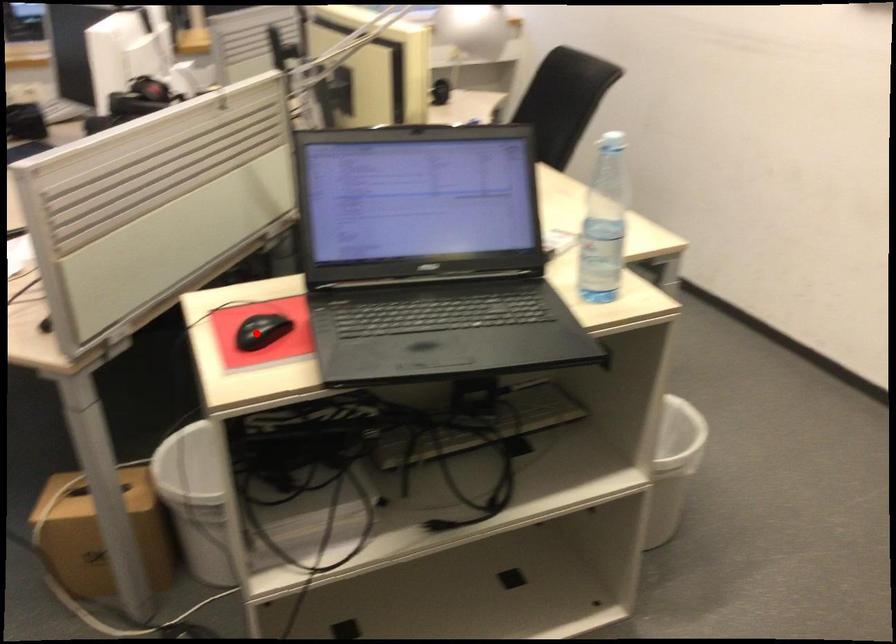
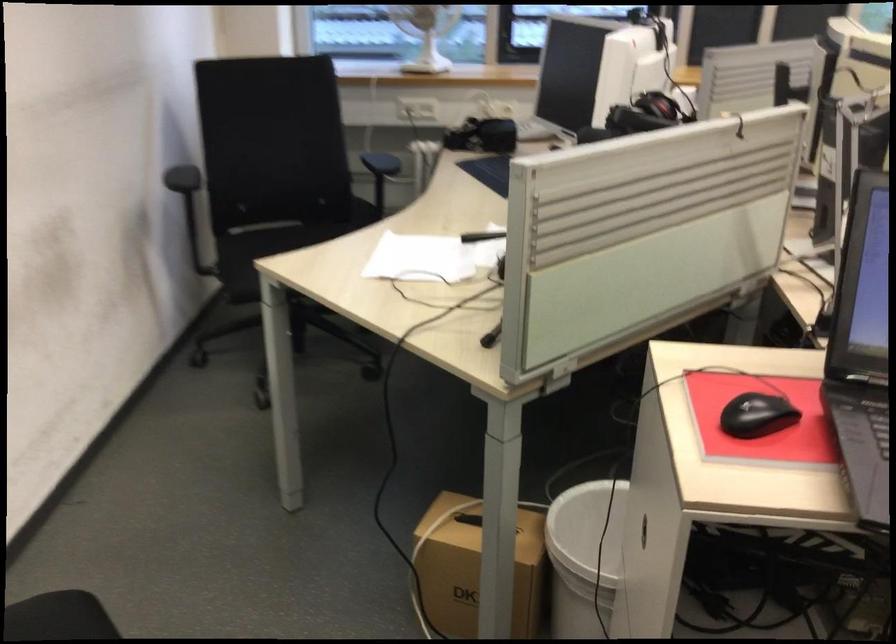
Locate, in the second image, the point that corresponds to the highlighted location in the first image.

(756, 415)